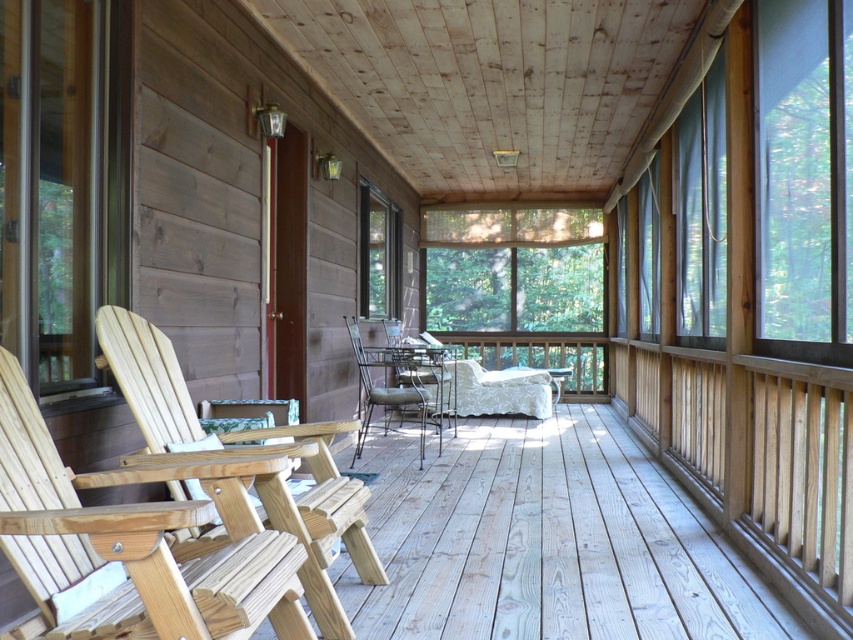
You are standing on the wooden porch of a cabin and want to sit down. You see a light brown wood chair at left and a metallic wire chair at center. Which chair is higher up?

The light brown wood chair at left is above the metallic wire chair at center, so it is higher up.

You are sitting on the porch and want to place a small potted plant between the metallic silver chair at center and the metallic wire chair at center. Which chair should the plant be closer to if you want it to be closer to the front of the porch?

The metallic silver chair at center is in front of the metallic wire chair at center, so placing the plant closer to the metallic silver chair at center would position it nearer to the front of the porch.